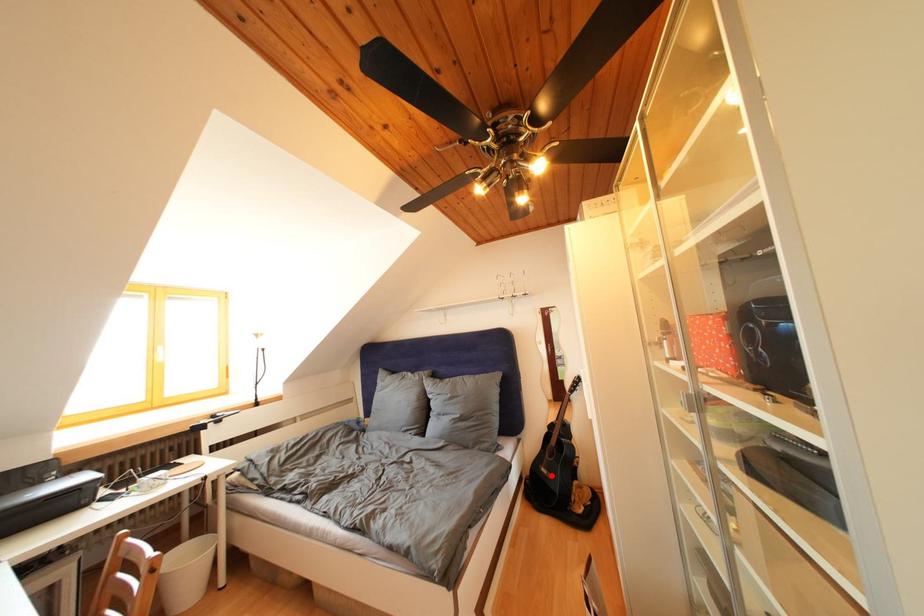
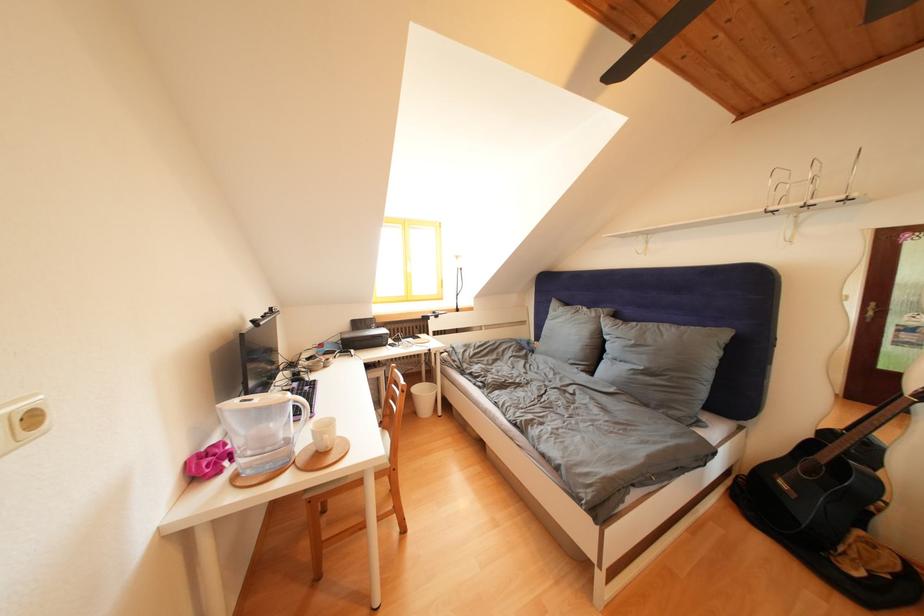
Question: A red point is marked in image1. In image2, is the corresponding 3D point closer to the camera or farther? Reply with the corresponding letter.

Choices:
 (A) The corresponding 3D point is closer.
 (B) The corresponding 3D point is farther.

Answer: (A)